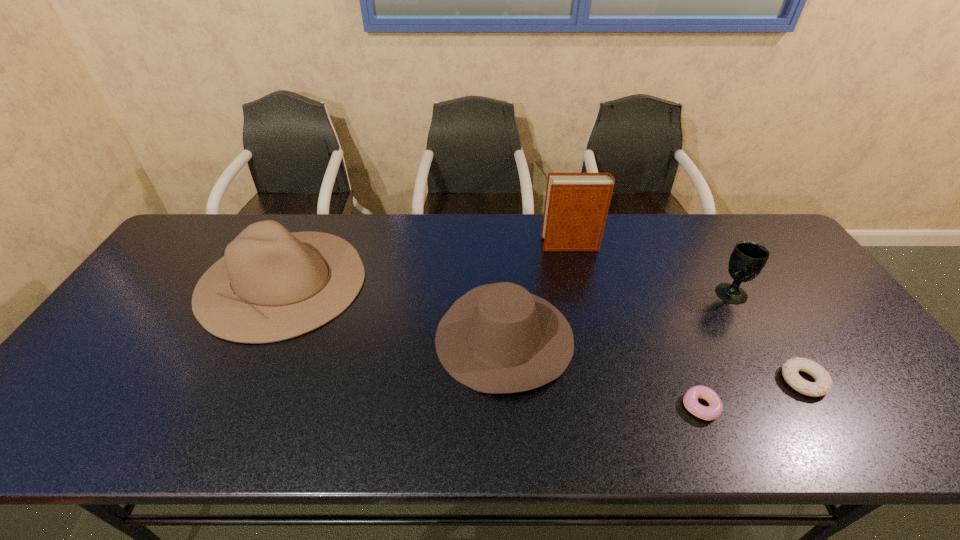
This screenshot has height=540, width=960. In order to click on free space at the far edge of the desktop in this screenshot , I will do `click(484, 244)`.

The image size is (960, 540). I want to click on vacant space at the near edge of the desktop, so click(523, 422).

Image resolution: width=960 pixels, height=540 pixels. In order to click on free space at the left edge of the desktop in this screenshot , I will do `click(130, 361)`.

In the image, there is a desktop. At what (x,y) coordinates should I click in order to perform the action: click on vacant space at the right edge. Please return your answer as a coordinate pair (x, y). Image resolution: width=960 pixels, height=540 pixels. Looking at the image, I should click on point(772,275).

Identify the location of vacant space at the far left corner of the desktop. This screenshot has height=540, width=960. (207, 241).

The image size is (960, 540). In order to click on vacant area at the far right corner of the desktop in this screenshot , I will do `click(756, 239)`.

Locate an element on the screen. Image resolution: width=960 pixels, height=540 pixels. unoccupied area between the chalice and the tallest object is located at coordinates (651, 269).

Locate an element on the screen. The width and height of the screenshot is (960, 540). vacant area between the left doughnut and the chalice is located at coordinates (716, 350).

This screenshot has width=960, height=540. In order to click on unoccupied area between the third object from right to left and the right doughnut in this screenshot , I will do `click(752, 394)`.

The width and height of the screenshot is (960, 540). I want to click on vacant region between the chalice and the right doughnut, so click(767, 337).